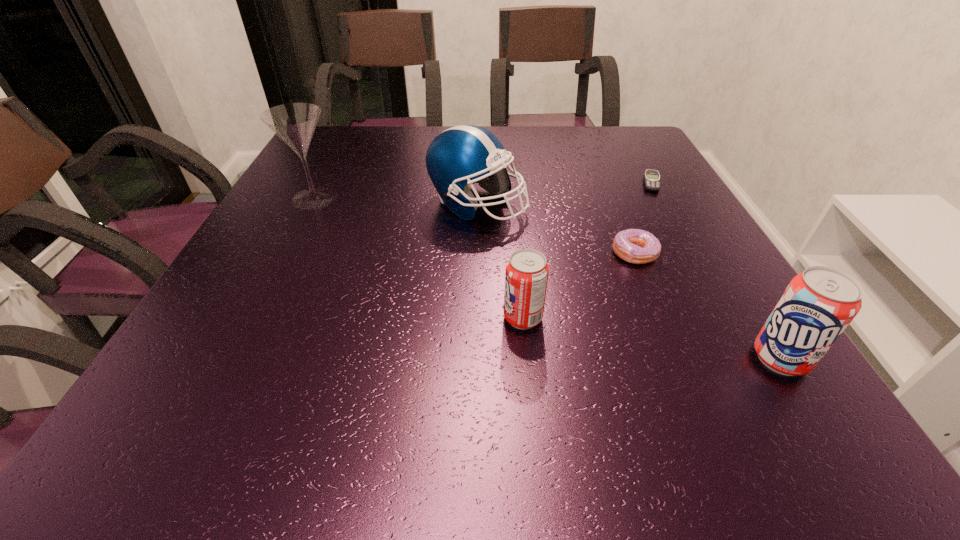
The image size is (960, 540). In order to click on empty space that is in between the nearer soda can and the farther soda can in this screenshot , I will do `click(652, 338)`.

Locate an element on the screen. This screenshot has width=960, height=540. vacant region between the football helmet and the fifth farthest object is located at coordinates (500, 261).

I want to click on vacant point located between the football helmet and the taller soda can, so click(629, 281).

Image resolution: width=960 pixels, height=540 pixels. In order to click on vacant space that is in between the third shortest object and the football helmet in this screenshot , I will do `click(500, 261)`.

Locate an element on the screen. free space between the fifth tallest object and the football helmet is located at coordinates (556, 228).

Identify the location of object that is the fifth closest to the doughnut. The width and height of the screenshot is (960, 540). (294, 123).

Find the location of a particular element. Image resolution: width=960 pixels, height=540 pixels. object that ranks as the fifth closest to the fifth farthest object is located at coordinates pos(652,180).

Identify the location of vacant position in the image that satisfies the following two spatial constraints: 1. on the back side of the nearer soda can; 2. at the front of the football helmet with the faceguard. (684, 204).

The width and height of the screenshot is (960, 540). I want to click on vacant position in the image that satisfies the following two spatial constraints: 1. on the back side of the beeper; 2. on the right side of the fourth object from left to right, so click(606, 183).

Locate an element on the screen. free space that satisfies the following two spatial constraints: 1. on the back side of the taller soda can; 2. at the front of the football helmet with the faceguard is located at coordinates (684, 204).